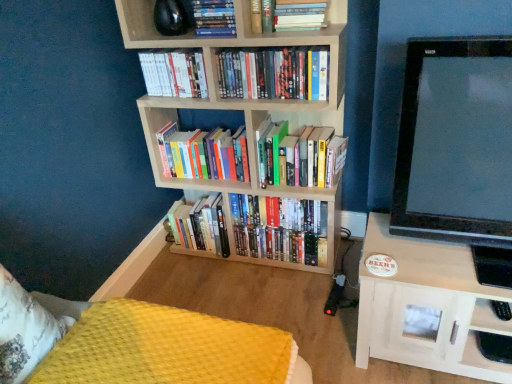
Question: Is hardcover books at center, which ranks as the 5th book in top-to-bottom order, closer to the viewer compared to hardcover books at center, the fifth book when ordered from bottom to top?

Choices:
 (A) no
 (B) yes

Answer: (A)

Question: Does hardcover books at center, placed as the fourth book when sorted from bottom to top, have a lesser height compared to hardcover books at center, placed as the fourth book when sorted from top to bottom?

Choices:
 (A) yes
 (B) no

Answer: (B)

Question: Is hardcover books at center, placed as the fourth book when sorted from bottom to top, thinner than hardcover books at center, placed as the fourth book when sorted from top to bottom?

Choices:
 (A) no
 (B) yes

Answer: (A)

Question: From a real-world perspective, is hardcover books at center, which ranks as the 5th book in top-to-bottom order, below hardcover books at center, the fifth book when ordered from bottom to top?

Choices:
 (A) no
 (B) yes

Answer: (B)

Question: Considering the relative sizes of hardcover books at center, placed as the fourth book when sorted from bottom to top, and hardcover books at center, placed as the fourth book when sorted from top to bottom, in the image provided, is hardcover books at center, placed as the fourth book when sorted from bottom to top, wider than hardcover books at center, placed as the fourth book when sorted from top to bottom,?

Choices:
 (A) yes
 (B) no

Answer: (A)

Question: Are hardcover books at center, placed as the fourth book when sorted from bottom to top, and hardcover books at center, the fifth book when ordered from bottom to top, making contact?

Choices:
 (A) no
 (B) yes

Answer: (A)

Question: From a real-world perspective, is hardcover books at upper center, acting as the 1th book starting from the top, physically below hardcover books at center, placed as the fourth book when sorted from top to bottom?

Choices:
 (A) no
 (B) yes

Answer: (A)

Question: Is hardcover books at upper center, which is the eighth book from bottom to top, far away from hardcover books at center, placed as the fourth book when sorted from top to bottom?

Choices:
 (A) yes
 (B) no

Answer: (B)

Question: Is the depth of hardcover books at upper center, acting as the 1th book starting from the top, greater than that of hardcover books at center, placed as the fourth book when sorted from top to bottom?

Choices:
 (A) no
 (B) yes

Answer: (A)

Question: From a real-world perspective, is hardcover books at upper center, which is the eighth book from bottom to top, positioned over hardcover books at center, placed as the fourth book when sorted from top to bottom, based on gravity?

Choices:
 (A) no
 (B) yes

Answer: (B)

Question: From the image's perspective, does hardcover books at upper center, which is the eighth book from bottom to top, appear higher than hardcover books at center, the fifth book when ordered from bottom to top?

Choices:
 (A) no
 (B) yes

Answer: (B)

Question: Does hardcover books at upper center, which is the eighth book from bottom to top, have a greater height compared to hardcover books at center, placed as the fourth book when sorted from top to bottom?

Choices:
 (A) no
 (B) yes

Answer: (A)

Question: Is hardcover books at center, marked as the 2th book in a bottom-to-top arrangement, inside hardcover books at center, the fifth book when ordered from bottom to top?

Choices:
 (A) yes
 (B) no

Answer: (B)